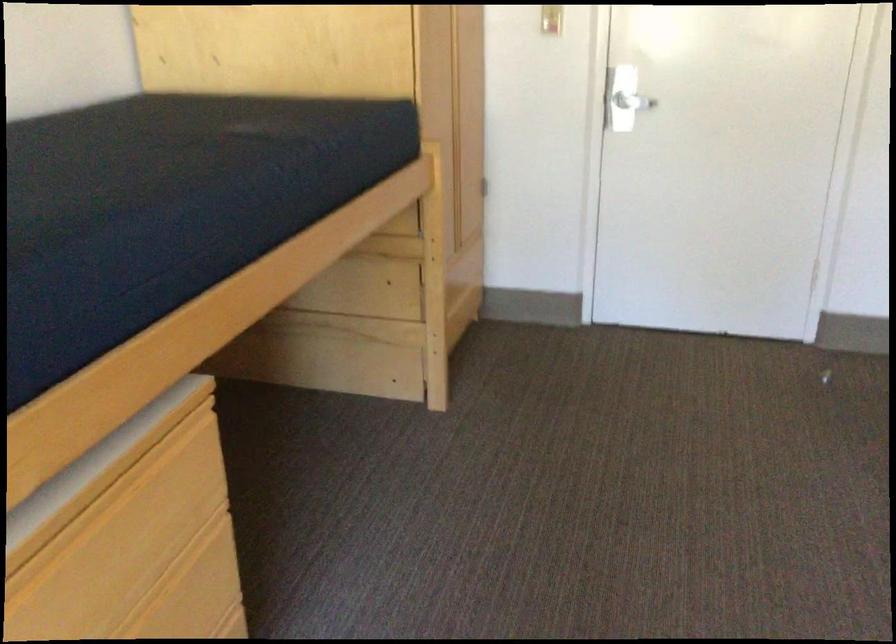
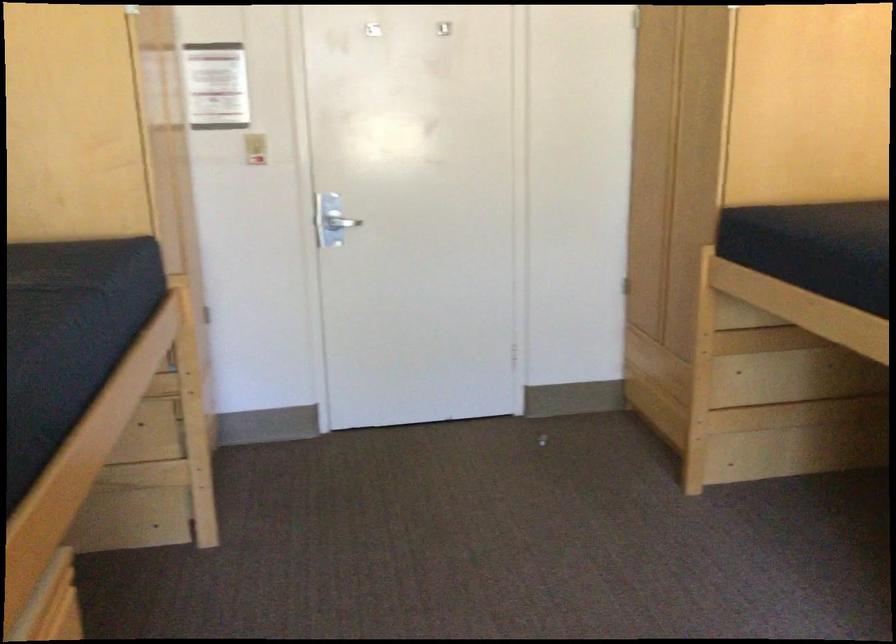
The point at (x=625, y=91) is marked in the first image. Where is the corresponding point in the second image?

(332, 222)